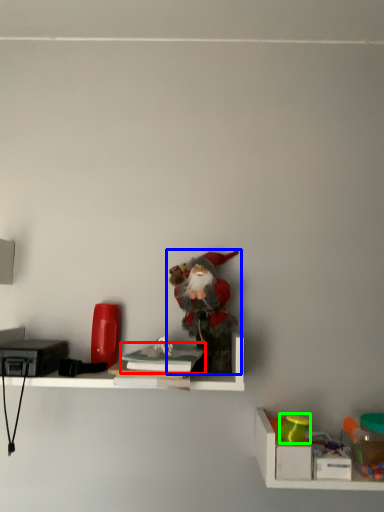
Question: Based on their relative distances, which object is nearer to book (highlighted by a red box)? Choose from toy (highlighted by a blue box) and toy (highlighted by a green box).

Choices:
 (A) toy
 (B) toy

Answer: (A)